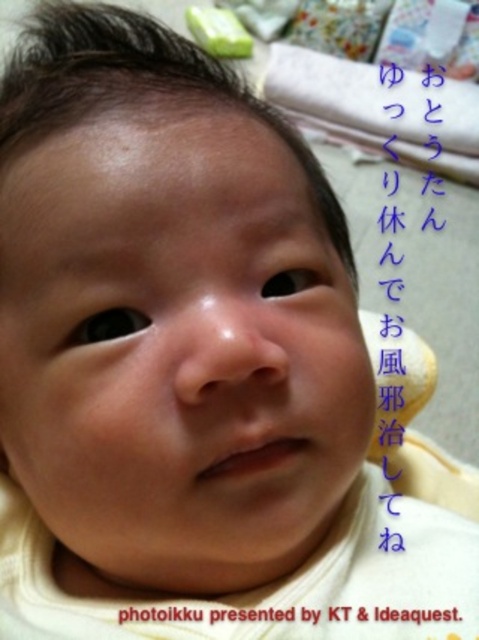
You are holding a baby in your arms and notice the blue paper at upper right and the green rubber toy at upper center in the room. Which object is farther away from the baby?

The blue paper at upper right and green rubber toy at upper center are 1.71 meters apart from each other, so the blue paper at upper right is farther away from the baby than the green rubber toy at upper center.

You are a parent holding a baby in a nursery. You notice the black paper at upper center and the green rubber toy at upper center. Which object is positioned to the right side of the other?

The black paper at upper center is to the right of the green rubber toy at upper center.

You are a photographer taking a close up of a baby. You notice two objects in the frame, the black paper at upper center and the green rubber toy at upper center. Which object is nearer to the camera?

The black paper at upper center is closer to the viewer than the green rubber toy at upper center, so the black paper at upper center is nearer to the camera.